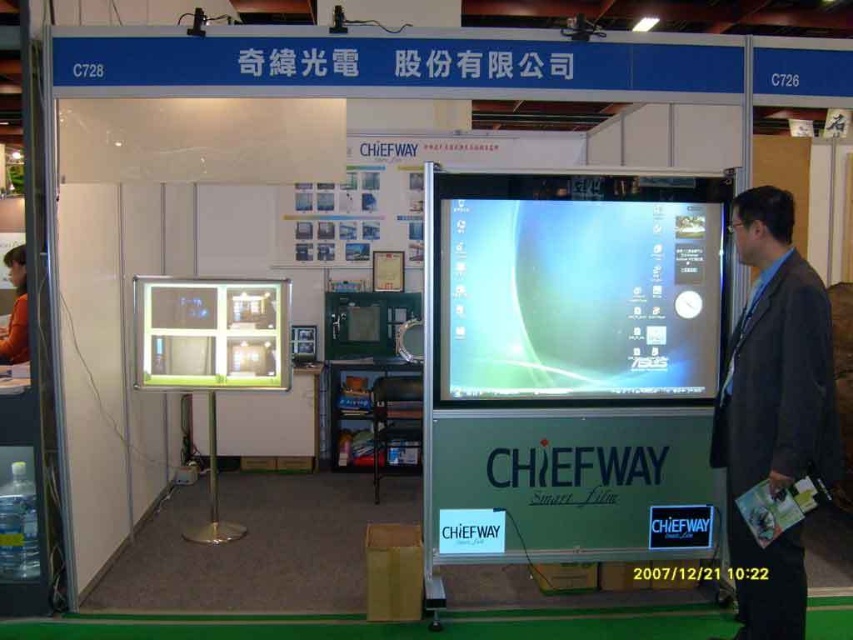
You are a visitor at the trade show booth. You want to see the dynamic image with curved design and icons on the larger screen. Which object should you walk towards, the matte glass monitor at center or the matte glass display at center?

The matte glass display at center is the larger screen showing the dynamic image with curved design and icons. Since the matte glass monitor at center is in front of the matte glass display at center, you should walk around or move to the side to get a clear view of the matte glass display at center.

You are a salesperson at the Chiefway booth. You need to demonstrate the smart film technology to a client standing in front of the booth. Which object should you focus on first, the matte glass monitor at center or the dark gray suit at right, based on their visibility from the client s perspective?

The matte glass monitor at center is more visible because it is wider than the dark gray suit at right, making it easier for the client to see the demonstration clearly.

You are standing at the Chiefway trade show booth labeled C728. You notice two points marked in the image. The first point is at coordinates point [786,326] and the second is at point [144,385]. Which point is closer to you?

Point [786,326] is closer to the camera than point [144,385].